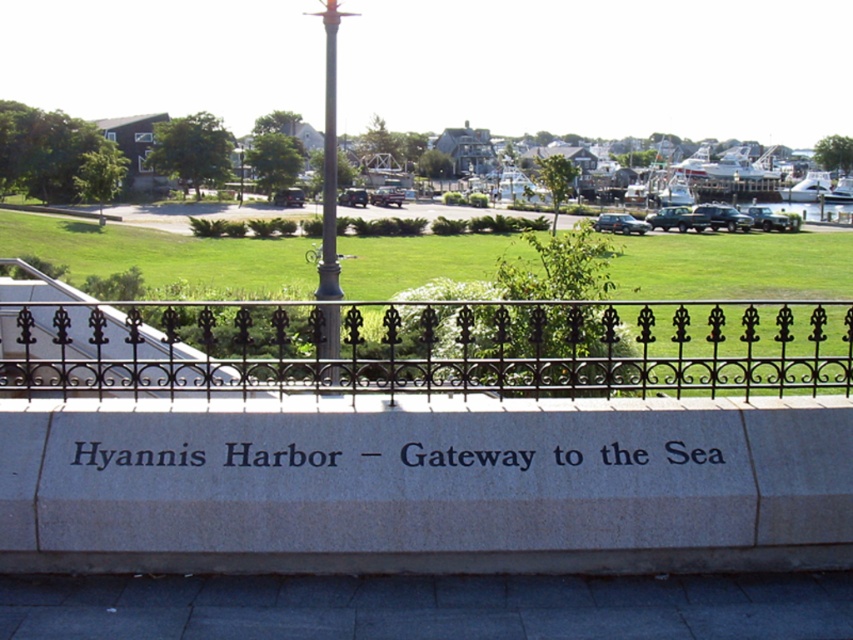
Question: Among these points, which one is farthest from the camera?

Choices:
 (A) (746, 634)
 (B) (509, 384)
 (C) (334, 465)

Answer: (B)

Question: Among these points, which one is nearest to the camera?

Choices:
 (A) (70, 464)
 (B) (422, 326)
 (C) (334, 236)

Answer: (A)

Question: Is black wrought iron fence at center smaller than polished metal pole at center?

Choices:
 (A) no
 (B) yes

Answer: (B)

Question: Which point is closer to the camera?

Choices:
 (A) polished metal pole at center
 (B) black stone sign at center
 (C) dark gray concrete pavement at lower center
 (D) black wrought iron fence at center

Answer: (C)

Question: Can you confirm if black wrought iron fence at center is thinner than black stone sign at center?

Choices:
 (A) yes
 (B) no

Answer: (B)

Question: Is black wrought iron fence at center thinner than dark gray concrete pavement at lower center?

Choices:
 (A) no
 (B) yes

Answer: (A)